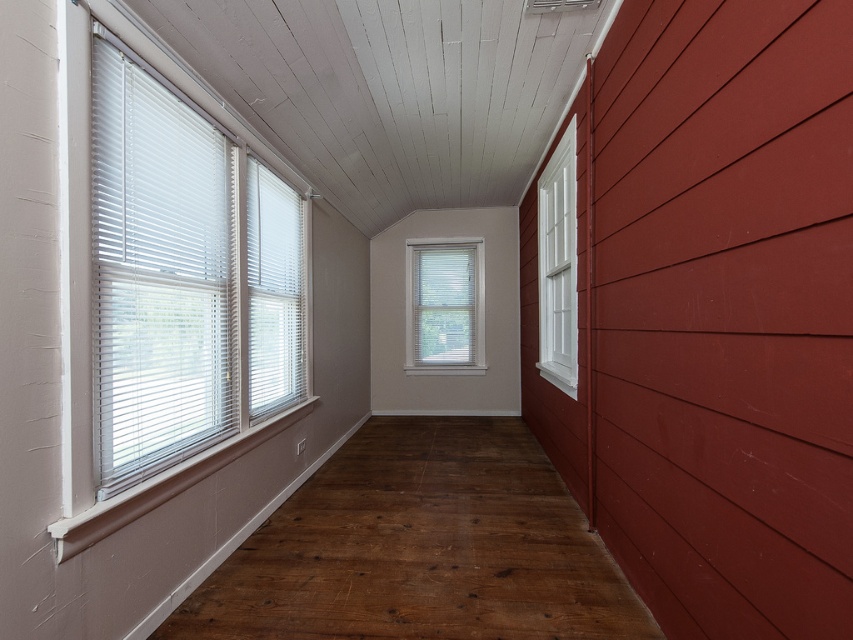
Does white blinds at left have a lesser height compared to white painted wood window at right?

Correct, white blinds at left is not as tall as white painted wood window at right.

Does point (148, 189) lie in front of point (573, 378)?

Yes, it is.

Identify the location of white blinds at left. (178, 276).

Can you confirm if white matte window at center is wider than white painted wood window at right?

Correct, the width of white matte window at center exceeds that of white painted wood window at right.

Does white matte window at center have a greater height compared to white painted wood window at right?

No, white matte window at center is not taller than white painted wood window at right.

Locate an element on the screen. The image size is (853, 640). white matte window at center is located at coordinates (444, 305).

Is white blinds at left smaller than white matte window at center?

No.

Is white blinds at left positioned behind white matte window at center?

Answer: No, it is not.

Does point (224, 234) come closer to viewer compared to point (451, 298)?

That is True.

Locate an element on the screen. white blinds at left is located at coordinates (178, 276).